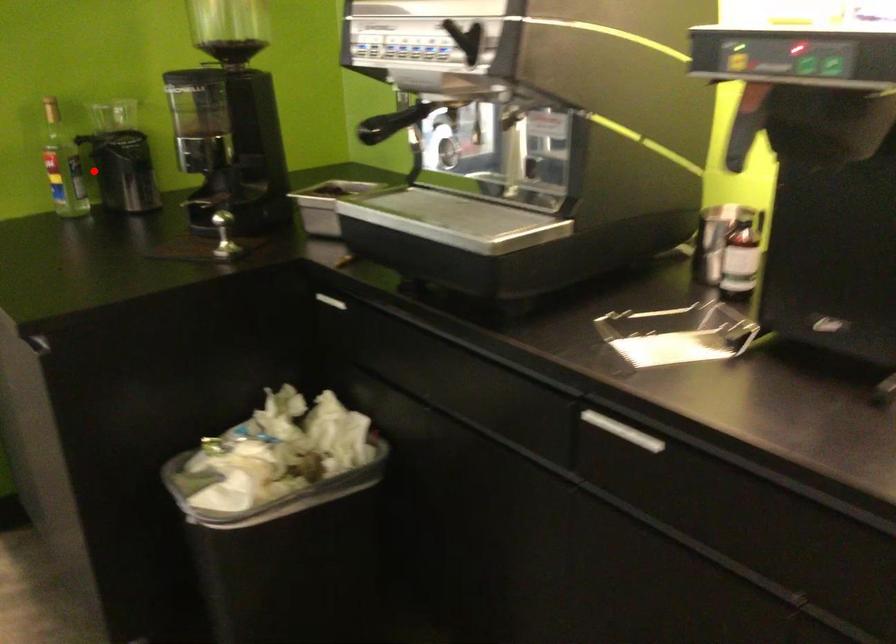
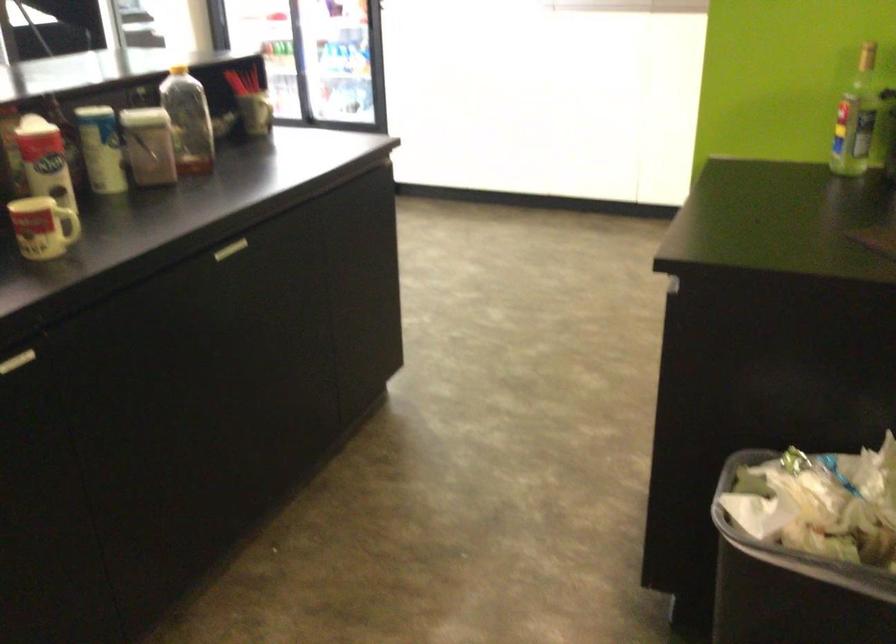
The point at the highlighted location is marked in the first image. Where is the corresponding point in the second image?

(856, 118)